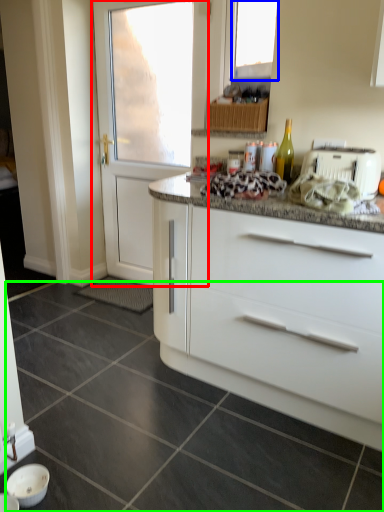
Question: Which object is the closest to the door (highlighted by a red box)? Choose among these: window (highlighted by a blue box) or granite (highlighted by a green box).

Choices:
 (A) window
 (B) granite

Answer: (A)